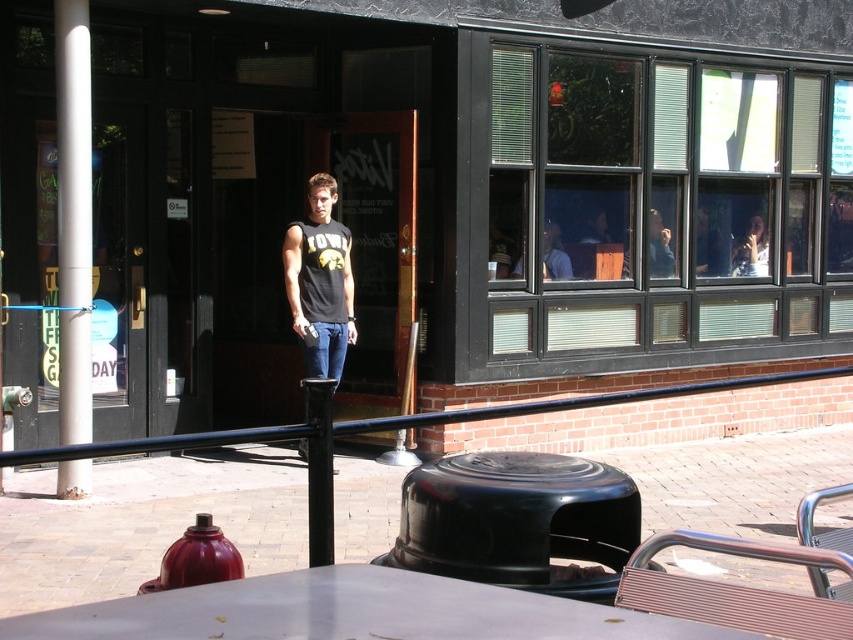
You are a customer entering the outdoor area of the cafe. You see a black rubber stool at center and a white glossy pole at left. Which object is closer to you as you approach the entrance?

The black rubber stool at center is closer to you because it is in front of the white glossy pole at left, meaning it is positioned nearer to your current position as you approach the entrance.

Looking at this image, you are standing at the entrance of the building and want to sit on the black rubber stool at center. Based on the 2D coordinates provided, in which direction should you walk to reach it?

The black rubber stool at center is located at coordinates 0.816 on the x axis and 0.608 on the y axis. Since you are at the entrance, which is typically at the lower left corner of the image, you should walk towards the upper right direction to reach the stool.